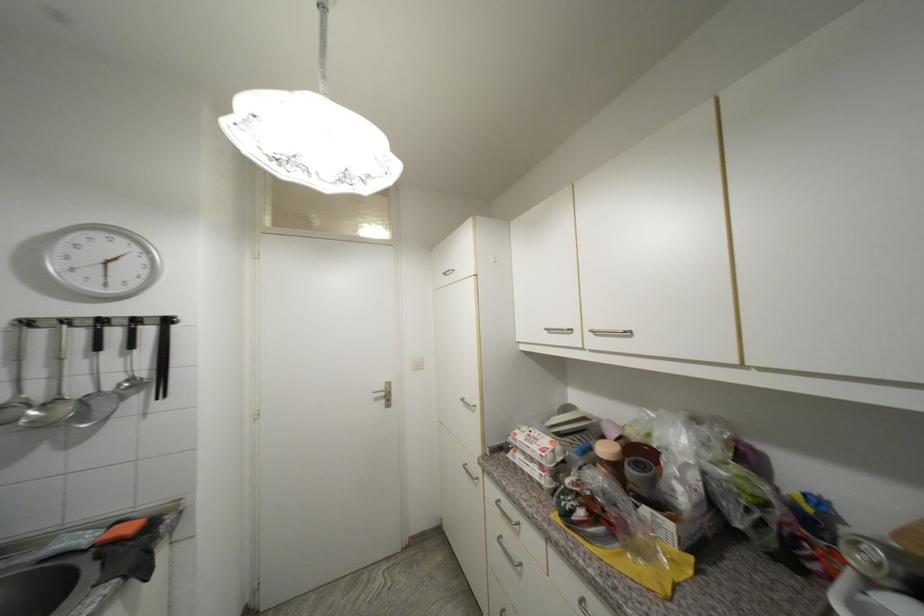
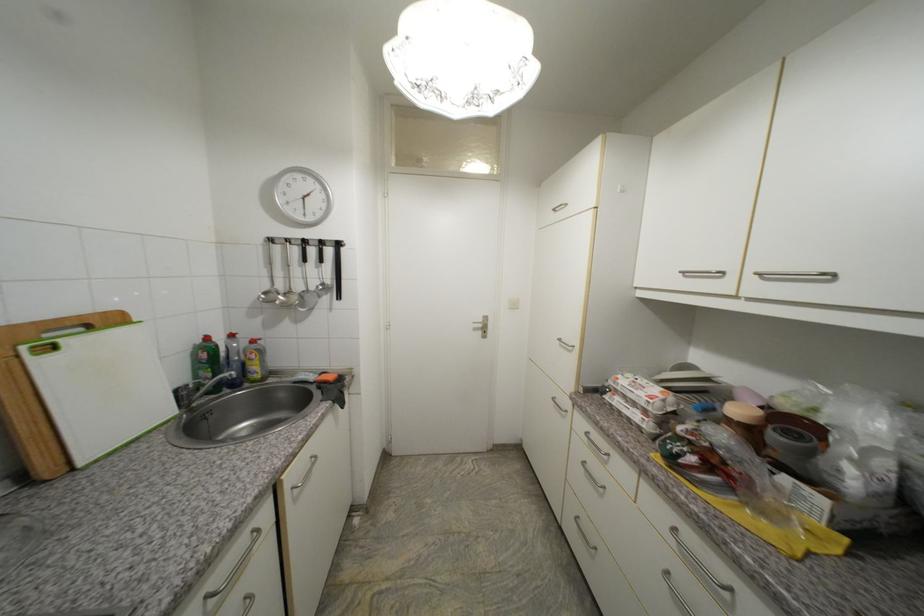
Where in the second image is the point corresponding to (x=521, y=436) from the first image?

(623, 379)